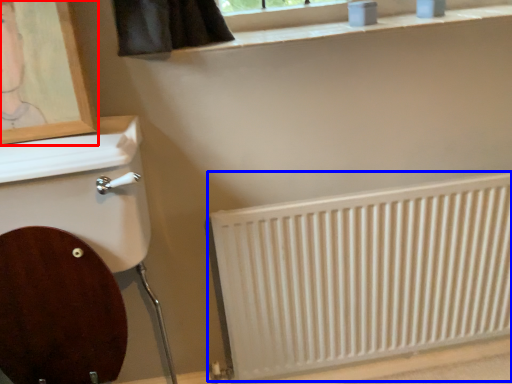
Question: Which object appears farthest to the camera in this image, picture frame (highlighted by a red box) or radiator (highlighted by a blue box)?

Choices:
 (A) picture frame
 (B) radiator

Answer: (B)